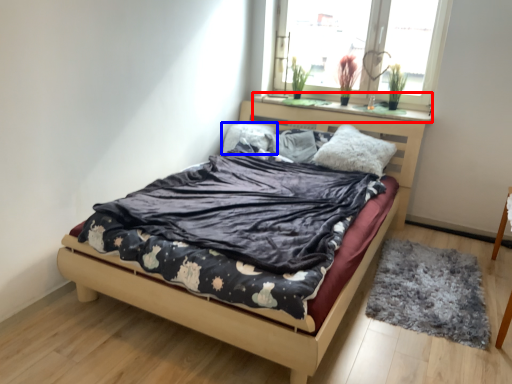
Question: Which object appears farthest to the camera in this image, window sill (highlighted by a red box) or pillow (highlighted by a blue box)?

Choices:
 (A) window sill
 (B) pillow

Answer: (B)